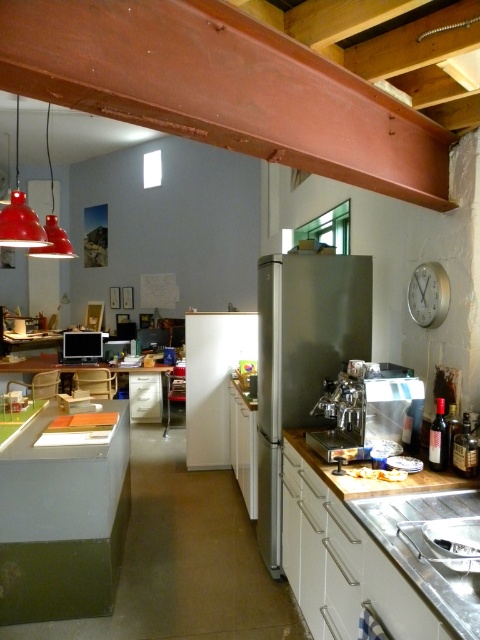
How distant is stainless steel refrigerator at center from silver metallic clock at upper right?

stainless steel refrigerator at center is 67.67 centimeters away from silver metallic clock at upper right.

In the scene shown: Which is above, stainless steel refrigerator at center or silver metallic clock at upper right?

Positioned higher is silver metallic clock at upper right.

Measure the distance between stainless steel refrigerator at center and camera.

They are 9.54 feet apart.

Locate an element on the screen. The height and width of the screenshot is (640, 480). stainless steel refrigerator at center is located at coordinates (301, 356).

From the picture: Which is more to the right, brown wooden beam at upper center or sleek metallic coffee machine at center?

sleek metallic coffee machine at center

Can you confirm if brown wooden beam at upper center is thinner than sleek metallic coffee machine at center?

In fact, brown wooden beam at upper center might be wider than sleek metallic coffee machine at center.

What do you see at coordinates (222, 88) in the screenshot? I see `brown wooden beam at upper center` at bounding box center [222, 88].

You are a GUI agent. You are given a task and a screenshot of the screen. Output one action in this format:
    pyautogui.click(x=<x>, y=<y>)
    Task: Click on the brown wooden beam at upper center
    
    Given the screenshot: What is the action you would take?
    pyautogui.click(x=222, y=88)

Can you confirm if silver metallic clock at upper right is positioned to the left of matte red pendant light at upper left?

Incorrect, silver metallic clock at upper right is not on the left side of matte red pendant light at upper left.

Is silver metallic clock at upper right positioned in front of matte red pendant light at upper left?

That is True.

Is point (418, 275) farther from camera compared to point (36, 243)?

No, (418, 275) is closer to viewer.

Locate an element on the screen. Image resolution: width=480 pixels, height=640 pixels. silver metallic clock at upper right is located at coordinates (429, 294).